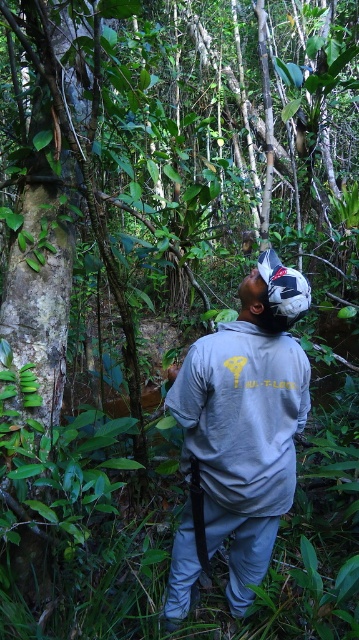
Does gray fabric shirt at center have a greater width compared to gray matte sweatshirt at center?

Yes, gray fabric shirt at center is wider than gray matte sweatshirt at center.

Is gray fabric shirt at center positioned at the back of gray matte sweatshirt at center?

No, gray fabric shirt at center is in front of gray matte sweatshirt at center.

This screenshot has width=359, height=640. I want to click on gray fabric shirt at center, so pos(246,419).

Locate an element on the screen. gray fabric shirt at center is located at coordinates (246, 419).